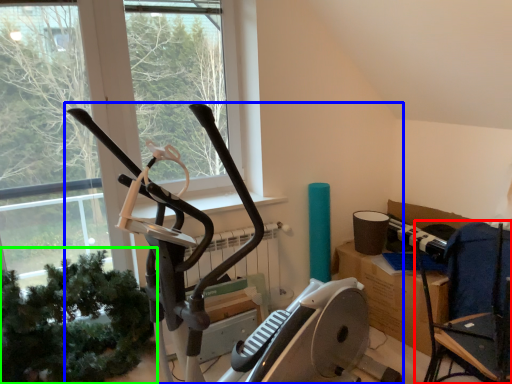
Question: Estimate the real-world distances between objects in this image. Which object is farther from chair (highlighted by a red box), stationary bicycle (highlighted by a blue box) or plant (highlighted by a green box)?

Choices:
 (A) stationary bicycle
 (B) plant

Answer: (B)